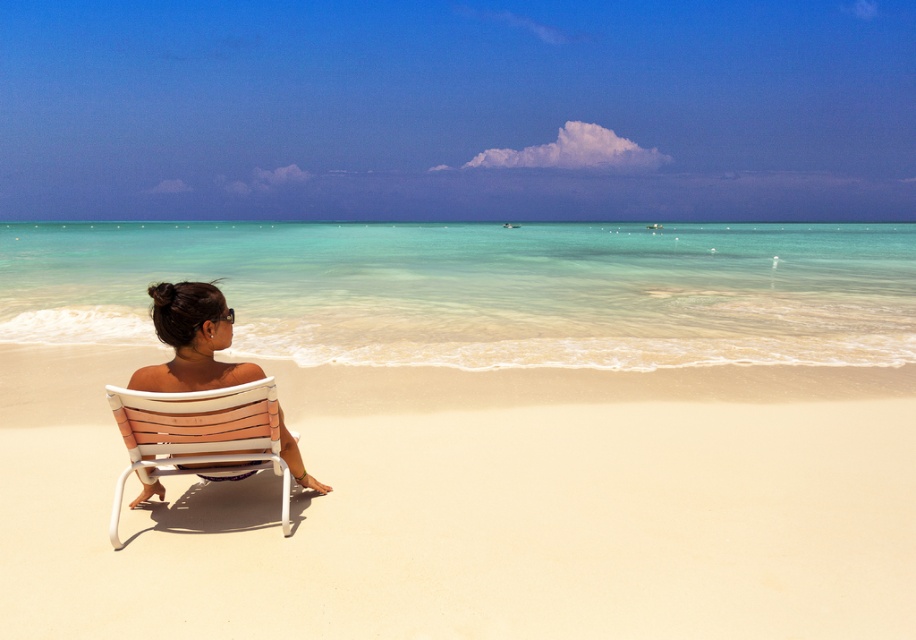
Does point (263, 426) come farther from viewer compared to point (204, 308)?

Yes, it is.

The width and height of the screenshot is (916, 640). Describe the element at coordinates (199, 435) in the screenshot. I see `white woven plastic chair at lower left` at that location.

At what (x,y) coordinates should I click in order to perform the action: click on white woven plastic chair at lower left. Please return your answer as a coordinate pair (x, y). Looking at the image, I should click on (199, 435).

Does beige sand at center have a lesser height compared to white woven plastic chair at lower left?

Indeed, beige sand at center has a lesser height compared to white woven plastic chair at lower left.

Locate an element on the screen. beige sand at center is located at coordinates (477, 506).

Between beige sand at center and matte white chair at center, which one is positioned higher?

matte white chair at center is above.

Between point (166, 522) and point (153, 484), which one is positioned behind?

The point (153, 484) is more distant.

What do you see at coordinates (477, 506) in the screenshot? I see `beige sand at center` at bounding box center [477, 506].

Locate an element on the screen. This screenshot has width=916, height=640. beige sand at center is located at coordinates (477, 506).